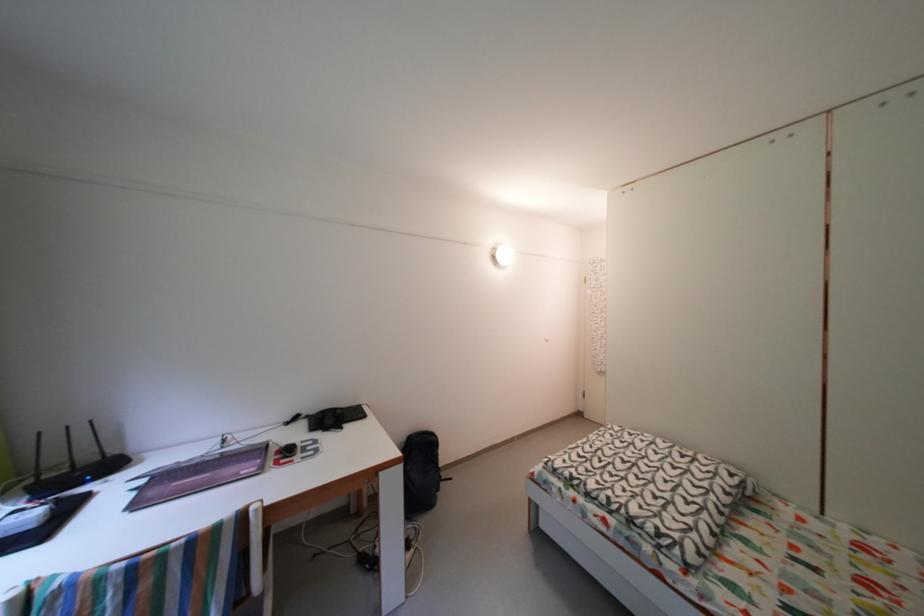
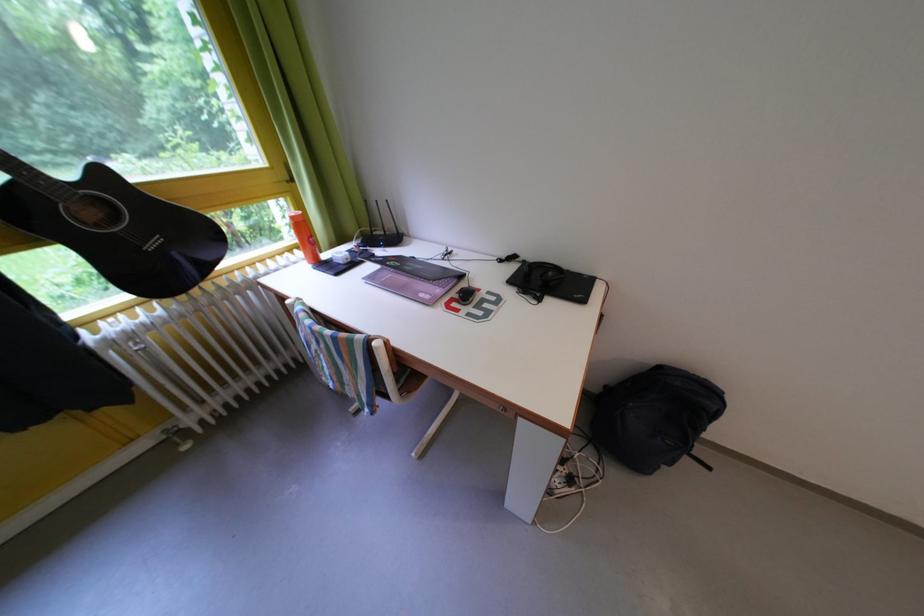
Find the pixel in the second image that matches the point at 76,476 in the first image.

(392, 238)